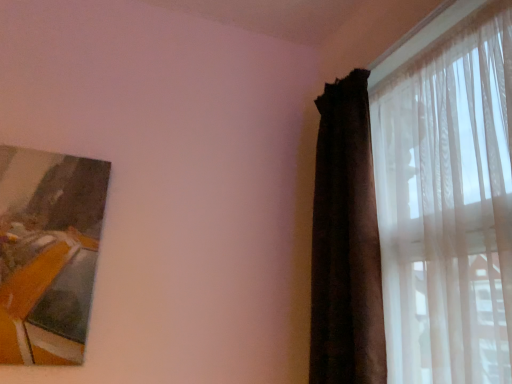
This screenshot has height=384, width=512. What do you see at coordinates (417, 221) in the screenshot?
I see `translucent sheer curtain at right, the 2th curtain when ordered from left to right` at bounding box center [417, 221].

You are a GUI agent. You are given a task and a screenshot of the screen. Output one action in this format:
    pyautogui.click(x=<x>, y=<y>)
    Task: Click on the wooden frame at upper left
    This screenshot has height=384, width=512.
    Given the screenshot: What is the action you would take?
    pyautogui.click(x=48, y=253)

This screenshot has height=384, width=512. Describe the element at coordinates (48, 253) in the screenshot. I see `wooden frame at upper left` at that location.

In order to click on translucent sheer curtain at right, placed as the first curtain when sorted from right to left in this screenshot , I will do `click(417, 221)`.

Could you tell me if wooden frame at upper left is facing dark velvet curtain at right, which ranks as the 2th curtain in right-to-left order?

No.

From the wooden frame at upper left, count 1st curtain to the right and point to it. Please provide its 2D coordinates.

[(346, 243)]

Considering the positions of objects wooden frame at upper left and dark velvet curtain at right, which ranks as the 2th curtain in right-to-left order, in the image provided, who is behind, wooden frame at upper left or dark velvet curtain at right, which ranks as the 2th curtain in right-to-left order,?

dark velvet curtain at right, which ranks as the 2th curtain in right-to-left order, is more distant.

Can you confirm if wooden frame at upper left is shorter than translucent sheer curtain at right, the 2th curtain when ordered from left to right?

Correct, wooden frame at upper left is not as tall as translucent sheer curtain at right, the 2th curtain when ordered from left to right.

Is wooden frame at upper left at the left side of translucent sheer curtain at right, placed as the first curtain when sorted from right to left?

Yes, wooden frame at upper left is to the left of translucent sheer curtain at right, placed as the first curtain when sorted from right to left.

In the scene shown: From the image's perspective, which one is positioned lower, wooden frame at upper left or translucent sheer curtain at right, placed as the first curtain when sorted from right to left?

wooden frame at upper left, from the image's perspective.

From the image's perspective, is dark velvet curtain at right, which ranks as the 2th curtain in right-to-left order, located above or below wooden frame at upper left?

Clearly, from the image's perspective, dark velvet curtain at right, which ranks as the 2th curtain in right-to-left order, is above wooden frame at upper left.

Are dark velvet curtain at right, which ranks as the 2th curtain in right-to-left order, and wooden frame at upper left making contact?

No, dark velvet curtain at right, which ranks as the 2th curtain in right-to-left order, is not touching wooden frame at upper left.

This screenshot has height=384, width=512. In order to click on picture frame below the dark velvet curtain at right, which ranks as the 2th curtain in right-to-left order (from a real-world perspective) in this screenshot , I will do `click(48, 253)`.

In the scene shown: Is dark velvet curtain at right, which ranks as the 2th curtain in right-to-left order, oriented towards translucent sheer curtain at right, placed as the first curtain when sorted from right to left?

Yes, dark velvet curtain at right, which ranks as the 2th curtain in right-to-left order, is aimed at translucent sheer curtain at right, placed as the first curtain when sorted from right to left.

Which is in front, dark velvet curtain at right, which ranks as the 2th curtain in right-to-left order, or translucent sheer curtain at right, placed as the first curtain when sorted from right to left?

Positioned in front is translucent sheer curtain at right, placed as the first curtain when sorted from right to left.

From the picture: Considering the relative sizes of dark velvet curtain at right, which ranks as the 2th curtain in right-to-left order, and translucent sheer curtain at right, placed as the first curtain when sorted from right to left, in the image provided, is dark velvet curtain at right, which ranks as the 2th curtain in right-to-left order, bigger than translucent sheer curtain at right, placed as the first curtain when sorted from right to left,?

Actually, dark velvet curtain at right, which ranks as the 2th curtain in right-to-left order, might be smaller than translucent sheer curtain at right, placed as the first curtain when sorted from right to left.

Can you tell me how much dark velvet curtain at right, placed as the 1th curtain when sorted from left to right, and translucent sheer curtain at right, placed as the first curtain when sorted from right to left, differ in facing direction?

dark velvet curtain at right, placed as the 1th curtain when sorted from left to right, and translucent sheer curtain at right, placed as the first curtain when sorted from right to left, are facing 90.4 degrees away from each other.

Is point (441, 149) closer or farther from the camera than point (331, 172)?

Point (441, 149) appears to be closer to the viewer than point (331, 172).

Locate an element on the screen. curtain to the left of translucent sheer curtain at right, placed as the first curtain when sorted from right to left is located at coordinates (346, 243).

Which of these two, translucent sheer curtain at right, the 2th curtain when ordered from left to right, or dark velvet curtain at right, placed as the 1th curtain when sorted from left to right, is wider?

dark velvet curtain at right, placed as the 1th curtain when sorted from left to right, is wider.

Is translucent sheer curtain at right, placed as the first curtain when sorted from right to left, oriented towards wooden frame at upper left?

Yes, translucent sheer curtain at right, placed as the first curtain when sorted from right to left, is facing wooden frame at upper left.

Is translucent sheer curtain at right, the 2th curtain when ordered from left to right, directly adjacent to wooden frame at upper left?

No, translucent sheer curtain at right, the 2th curtain when ordered from left to right, is not beside wooden frame at upper left.

Considering the positions of objects translucent sheer curtain at right, the 2th curtain when ordered from left to right, and wooden frame at upper left in the image provided, who is in front, translucent sheer curtain at right, the 2th curtain when ordered from left to right, or wooden frame at upper left?

Positioned in front is translucent sheer curtain at right, the 2th curtain when ordered from left to right.

I want to click on curtain that appears behind the wooden frame at upper left, so click(346, 243).

From a real-world perspective, which curtain is the 1st one above the wooden frame at upper left? Please provide its 2D coordinates.

[(417, 221)]

When comparing their distances from wooden frame at upper left, does translucent sheer curtain at right, the 2th curtain when ordered from left to right, or dark velvet curtain at right, placed as the 1th curtain when sorted from left to right, seem closer?

dark velvet curtain at right, placed as the 1th curtain when sorted from left to right.

When comparing their distances from translucent sheer curtain at right, the 2th curtain when ordered from left to right, does wooden frame at upper left or dark velvet curtain at right, which ranks as the 2th curtain in right-to-left order, seem closer?

Based on the image, dark velvet curtain at right, which ranks as the 2th curtain in right-to-left order, appears to be nearer to translucent sheer curtain at right, the 2th curtain when ordered from left to right.

From the image, which object appears to be farther from translucent sheer curtain at right, the 2th curtain when ordered from left to right, dark velvet curtain at right, which ranks as the 2th curtain in right-to-left order, or wooden frame at upper left?

Among the two, wooden frame at upper left is located further to translucent sheer curtain at right, the 2th curtain when ordered from left to right.

Based on their spatial positions, is translucent sheer curtain at right, placed as the first curtain when sorted from right to left, or wooden frame at upper left further from dark velvet curtain at right, which ranks as the 2th curtain in right-to-left order?

The object further to dark velvet curtain at right, which ranks as the 2th curtain in right-to-left order, is wooden frame at upper left.

Based on their spatial positions, is wooden frame at upper left or translucent sheer curtain at right, the 2th curtain when ordered from left to right, further from dark velvet curtain at right, placed as the 1th curtain when sorted from left to right?

Among the two, wooden frame at upper left is located further to dark velvet curtain at right, placed as the 1th curtain when sorted from left to right.

Looking at the image, which one is located further to wooden frame at upper left, dark velvet curtain at right, which ranks as the 2th curtain in right-to-left order, or translucent sheer curtain at right, placed as the first curtain when sorted from right to left?

Based on the image, translucent sheer curtain at right, placed as the first curtain when sorted from right to left, appears to be further to wooden frame at upper left.

At what (x,y) coordinates should I click in order to perform the action: click on curtain between wooden frame at upper left and translucent sheer curtain at right, placed as the first curtain when sorted from right to left. Please return your answer as a coordinate pair (x, y). This screenshot has width=512, height=384. Looking at the image, I should click on (346, 243).